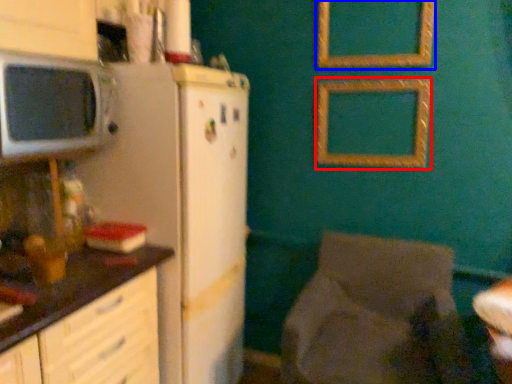
Question: Which object is further to the camera taking this photo, picture frame (highlighted by a red box) or picture frame (highlighted by a blue box)?

Choices:
 (A) picture frame
 (B) picture frame

Answer: (A)